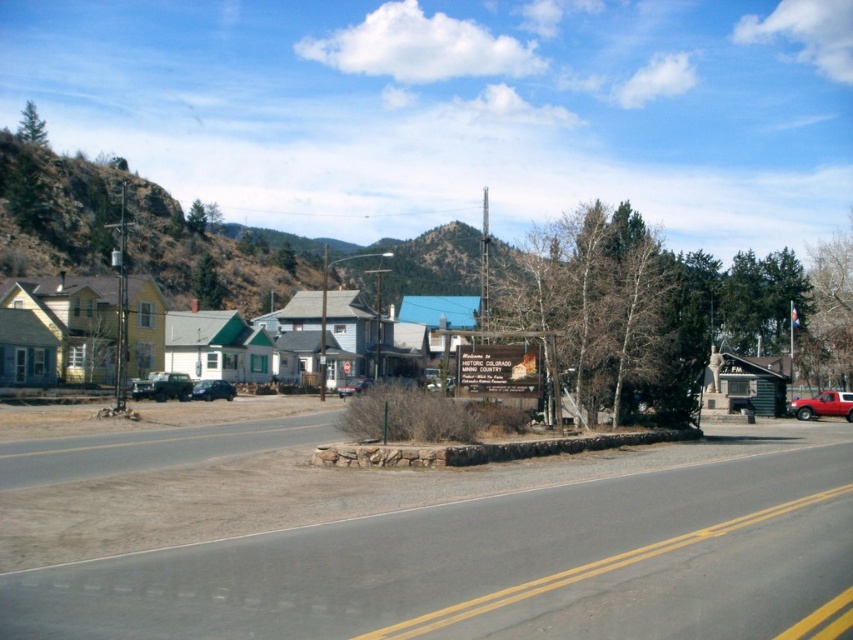
Who is shorter, yellow wood houses at center or metallic silver sedan at center?

metallic silver sedan at center

In order to click on yellow wood houses at center in this screenshot , I will do `click(219, 339)`.

Is the position of yellow wood houses at center more distant than that of red matte truck at right?

Yes, yellow wood houses at center is further from the viewer.

Is point (177, 364) positioned behind point (821, 394)?

Yes, point (177, 364) is behind point (821, 394).

I want to click on yellow wood houses at center, so click(219, 339).

Does red matte truck at right appear on the left side of metallic silver car at center?

→ In fact, red matte truck at right is to the right of metallic silver car at center.

Which is behind, point (849, 406) or point (210, 390)?

The point (210, 390) is more distant.

Does point (836, 416) come farther from viewer compared to point (218, 397)?

No, (836, 416) is closer to viewer.

I want to click on red matte truck at right, so click(822, 404).